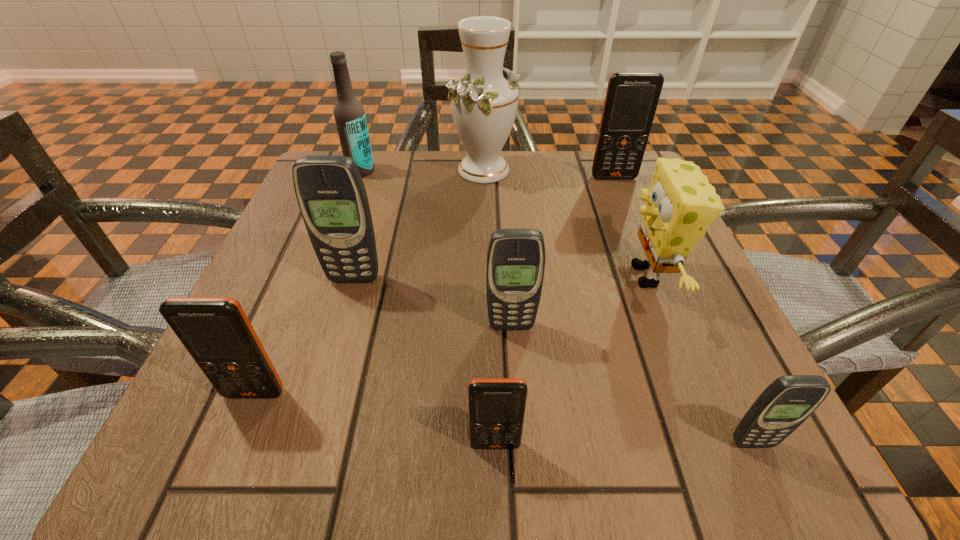
You are a GUI agent. You are given a task and a screenshot of the screen. Output one action in this format:
    pyautogui.click(x=<x>, y=<y>)
    Task: Click on the vase
    The image size is (960, 540).
    Given the screenshot: What is the action you would take?
    pyautogui.click(x=484, y=102)

This screenshot has height=540, width=960. Find the location of `beer bottle`. beer bottle is located at coordinates (349, 114).

Find the location of a particular element. The image size is (960, 540). the biggest orange cellular telephone is located at coordinates (631, 100).

At what (x,y) coordinates should I click in order to perform the action: click on the rightmost orange cellular telephone. Please return your answer as a coordinate pair (x, y). The height and width of the screenshot is (540, 960). Looking at the image, I should click on (631, 100).

In order to click on the second farthest cellular telephone in this screenshot , I will do `click(331, 195)`.

Find the location of a particular element. This screenshot has height=540, width=960. the biggest gray cellular telephone is located at coordinates (331, 195).

Find the location of a particular element. sponge is located at coordinates (x=680, y=204).

Where is `the second farthest gray cellular telephone`? This screenshot has height=540, width=960. the second farthest gray cellular telephone is located at coordinates (516, 257).

This screenshot has width=960, height=540. Identify the location of the fourth nearest cellular telephone. (516, 257).

You are a GUI agent. You are given a task and a screenshot of the screen. Output one action in this format:
    pyautogui.click(x=<x>, y=<y>)
    Task: Click on the leftmost orange cellular telephone
    Image resolution: width=960 pixels, height=540 pixels.
    Given the screenshot: What is the action you would take?
    pyautogui.click(x=217, y=333)